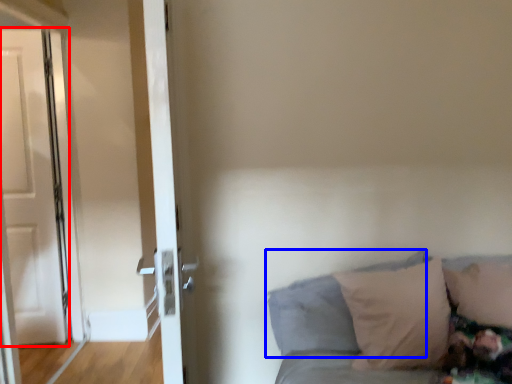
Question: Which of the following is the closest to the observer, door (highlighted by a red box) or pillow (highlighted by a blue box)?

Choices:
 (A) door
 (B) pillow

Answer: (B)